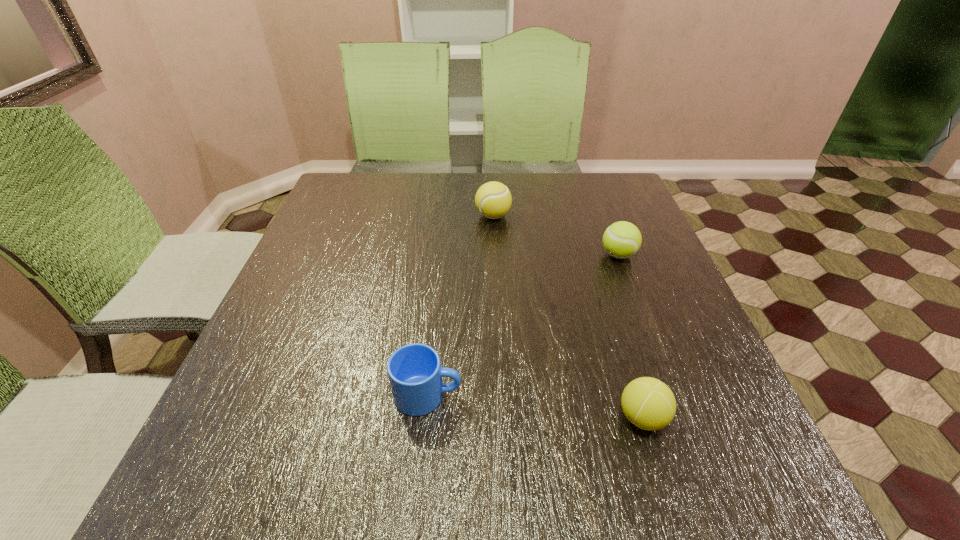
Locate an element on the screen. The width and height of the screenshot is (960, 540). the leftmost tennis ball is located at coordinates (493, 200).

Find the location of a particular element. The image size is (960, 540). the third object from right to left is located at coordinates (493, 200).

Identify the location of the second farthest tennis ball. Image resolution: width=960 pixels, height=540 pixels. (622, 239).

Image resolution: width=960 pixels, height=540 pixels. Identify the location of mug. (415, 373).

Find the location of a particular element. the nearest tennis ball is located at coordinates (648, 403).

This screenshot has width=960, height=540. I want to click on vacant region located 0.390m on the left of the farthest object, so click(334, 216).

At what (x,y) coordinates should I click in order to perform the action: click on free region located 0.250m on the front of the second farthest tennis ball. Please return your answer as a coordinate pair (x, y). This screenshot has height=540, width=960. Looking at the image, I should click on (654, 347).

Where is `free space located on the side of the mug with the handle`? The height and width of the screenshot is (540, 960). free space located on the side of the mug with the handle is located at coordinates (630, 395).

The width and height of the screenshot is (960, 540). I want to click on free space located 0.260m on the back of the nearest tennis ball, so click(x=605, y=296).

The image size is (960, 540). In order to click on object that is at the far edge in this screenshot , I will do `click(493, 200)`.